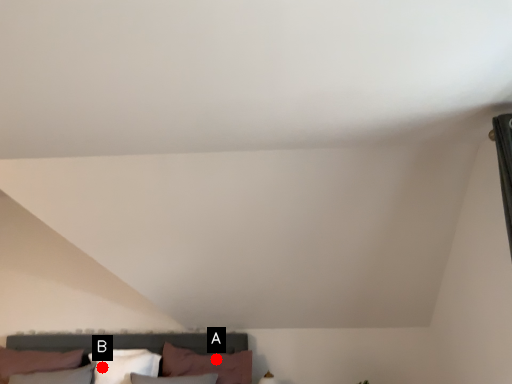
Question: Two points are circled on the image, labeled by A and B beside each circle. Which point is further to the camera?

Choices:
 (A) A is further
 (B) B is further

Answer: (A)